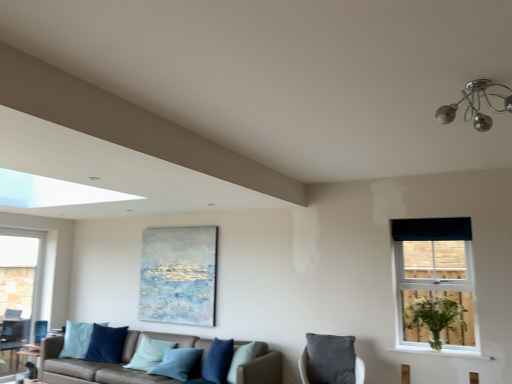
Question: Is textured canvas painting at center bigger than leather couch with blue pillows at lower center?

Choices:
 (A) yes
 (B) no

Answer: (B)

Question: Is textured canvas painting at center further to the viewer compared to leather couch with blue pillows at lower center?

Choices:
 (A) yes
 (B) no

Answer: (A)

Question: Could you tell me if textured canvas painting at center is turned towards leather couch with blue pillows at lower center?

Choices:
 (A) no
 (B) yes

Answer: (A)

Question: Is textured canvas painting at center positioned far away from leather couch with blue pillows at lower center?

Choices:
 (A) no
 (B) yes

Answer: (B)

Question: Does textured canvas painting at center appear on the left side of leather couch with blue pillows at lower center?

Choices:
 (A) yes
 (B) no

Answer: (B)

Question: From the image's perspective, is textured canvas painting at center located above leather couch with blue pillows at lower center?

Choices:
 (A) yes
 (B) no

Answer: (A)

Question: Is the depth of leather couch with blue pillows at lower center less than that of chrome metallic chandelier at upper right?

Choices:
 (A) yes
 (B) no

Answer: (B)

Question: Could you tell me if leather couch with blue pillows at lower center is facing chrome metallic chandelier at upper right?

Choices:
 (A) no
 (B) yes

Answer: (A)

Question: Is leather couch with blue pillows at lower center in contact with chrome metallic chandelier at upper right?

Choices:
 (A) no
 (B) yes

Answer: (A)

Question: Considering the relative positions of leather couch with blue pillows at lower center and chrome metallic chandelier at upper right in the image provided, is leather couch with blue pillows at lower center to the left of chrome metallic chandelier at upper right from the viewer's perspective?

Choices:
 (A) no
 (B) yes

Answer: (B)

Question: Does leather couch with blue pillows at lower center have a larger size compared to chrome metallic chandelier at upper right?

Choices:
 (A) yes
 (B) no

Answer: (A)

Question: From a real-world perspective, does leather couch with blue pillows at lower center stand above chrome metallic chandelier at upper right?

Choices:
 (A) yes
 (B) no

Answer: (B)

Question: Would you say black fabric curtain at upper right is outside chrome metallic chandelier at upper right?

Choices:
 (A) yes
 (B) no

Answer: (A)